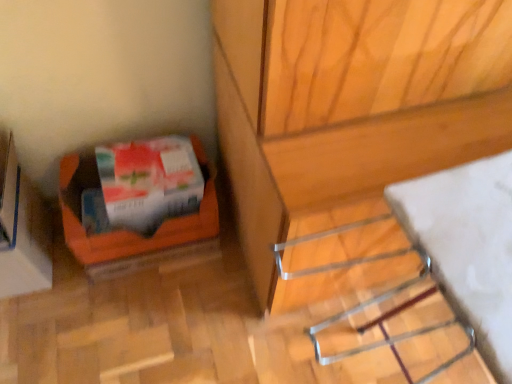
Describe the element at coordinates (129, 231) in the screenshot. I see `orange cardboard box at lower left` at that location.

Measure the distance between orange cardboard box at lower left and camera.

They are 3.63 feet apart.

What is the approximate width of metallic silver rack at lower right?

It is 30.26 centimeters.

The width and height of the screenshot is (512, 384). Find the location of `white glossy wrapping paper at lower left`. white glossy wrapping paper at lower left is located at coordinates (149, 182).

Based on their positions, is white glossy wrapping paper at lower left located to the left or right of metallic silver rack at lower right?

Based on their positions, white glossy wrapping paper at lower left is located to the left of metallic silver rack at lower right.

At what (x,y) coordinates should I click in order to perform the action: click on wrapping paper on the left of metallic silver rack at lower right. Please return your answer as a coordinate pair (x, y). The width and height of the screenshot is (512, 384). Looking at the image, I should click on (149, 182).

From the image's perspective, which is below, white glossy wrapping paper at lower left or metallic silver rack at lower right?

From the image's view, metallic silver rack at lower right is below.

From the image's perspective, which object appears higher, white glossy wrapping paper at lower left or orange cardboard box at lower left?

white glossy wrapping paper at lower left, from the image's perspective.

Is white glossy wrapping paper at lower left spatially inside orange cardboard box at lower left, or outside of it?

The correct answer is: outside.

From a real-world perspective, which object stands above the other?

white glossy wrapping paper at lower left.

Between white glossy wrapping paper at lower left and orange cardboard box at lower left, which one appears on the left side from the viewer's perspective?

orange cardboard box at lower left is more to the left.

Can you tell me how much orange cardboard box at lower left and metallic silver rack at lower right differ in facing direction?

5.37 degrees.

Consider the image. Does orange cardboard box at lower left come behind metallic silver rack at lower right?

Yes, orange cardboard box at lower left is further from the viewer.

Is orange cardboard box at lower left placed right next to metallic silver rack at lower right?

There is a gap between orange cardboard box at lower left and metallic silver rack at lower right.

Locate an element on the screen. furniture that appears above the orange cardboard box at lower left (from a real-world perspective) is located at coordinates (350, 123).

Can you tell me how much metallic silver rack at lower right and orange cardboard box at lower left differ in facing direction?

5.37 degrees separate the facing orientations of metallic silver rack at lower right and orange cardboard box at lower left.

Measure the distance between metallic silver rack at lower right and orange cardboard box at lower left.

metallic silver rack at lower right is 30.86 inches from orange cardboard box at lower left.

Considering the positions of objects metallic silver rack at lower right and orange cardboard box at lower left in the image provided, who is more to the left, metallic silver rack at lower right or orange cardboard box at lower left?

orange cardboard box at lower left.

From the image's perspective, relative to orange cardboard box at lower left, is metallic silver rack at lower right above or below?

Clearly, from the image's perspective, metallic silver rack at lower right is below orange cardboard box at lower left.

Is orange cardboard box at lower left spatially inside white glossy wrapping paper at lower left, or outside of it?

orange cardboard box at lower left is not inside white glossy wrapping paper at lower left, it's outside.

How many degrees apart are the facing directions of orange cardboard box at lower left and white glossy wrapping paper at lower left?

The angular difference between orange cardboard box at lower left and white glossy wrapping paper at lower left is 0.00155 degrees.

Considering their positions, is orange cardboard box at lower left located in front of or behind white glossy wrapping paper at lower left?

Clearly, orange cardboard box at lower left is behind white glossy wrapping paper at lower left.

Is orange cardboard box at lower left directly adjacent to white glossy wrapping paper at lower left?

Yes, orange cardboard box at lower left is next to white glossy wrapping paper at lower left.

How many degrees apart are the facing directions of orange cardboard box at lower left and orange cardboard box at lower left?

The facing directions of orange cardboard box at lower left and orange cardboard box at lower left are 0.0029 degrees apart.

You are a GUI agent. You are given a task and a screenshot of the screen. Output one action in this format:
    pyautogui.click(x=<x>, y=<y>)
    Task: Click on the box that appears on the right of orange cardboard box at lower left
    The height and width of the screenshot is (384, 512).
    Given the screenshot: What is the action you would take?
    pyautogui.click(x=129, y=231)

Looking at this image, can orange cardboard box at lower left be found inside orange cardboard box at lower left?

No, orange cardboard box at lower left is located outside of orange cardboard box at lower left.

Could you tell me if orange cardboard box at lower left is turned towards orange cardboard box at lower left?

No, orange cardboard box at lower left is not oriented towards orange cardboard box at lower left.

Does point (75, 163) come behind point (27, 267)?

Yes, point (75, 163) is behind point (27, 267).

Consider the image. From a real-world perspective, which object rests below the other?

Result: orange cardboard box at lower left is physically lower.

Between orange cardboard box at lower left and orange cardboard box at lower left, which one appears on the left side from the viewer's perspective?

orange cardboard box at lower left is more to the left.

How different are the orientations of orange cardboard box at lower left and orange cardboard box at lower left in degrees?

The angle between the facing direction of orange cardboard box at lower left and the facing direction of orange cardboard box at lower left is 0.0029 degrees.

Where is `furniture on the right of the white glossy wrapping paper at lower left`? This screenshot has height=384, width=512. furniture on the right of the white glossy wrapping paper at lower left is located at coordinates (350, 123).

Locate an element on the screen. The image size is (512, 384). wrapping paper behind the orange cardboard box at lower left is located at coordinates (149, 182).

Looking at the image, which one is located closer to white glossy wrapping paper at lower left, orange cardboard box at lower left or orange cardboard box at lower left?

Based on the image, orange cardboard box at lower left appears to be nearer to white glossy wrapping paper at lower left.

Looking at this image, looking at the image, which one is located closer to orange cardboard box at lower left, orange cardboard box at lower left or white glossy wrapping paper at lower left?

white glossy wrapping paper at lower left is closer to orange cardboard box at lower left.

From the image, which object appears to be nearer to orange cardboard box at lower left, orange cardboard box at lower left or metallic silver rack at lower right?

Based on the image, orange cardboard box at lower left appears to be nearer to orange cardboard box at lower left.

Looking at the image, which one is located further to white glossy wrapping paper at lower left, orange cardboard box at lower left or orange cardboard box at lower left?

orange cardboard box at lower left is positioned further to the anchor white glossy wrapping paper at lower left.

From the image, which object appears to be farther from orange cardboard box at lower left, white glossy wrapping paper at lower left or orange cardboard box at lower left?

orange cardboard box at lower left lies further to orange cardboard box at lower left than the other object.

Which object lies nearer to the anchor point white glossy wrapping paper at lower left, metallic silver rack at lower right or orange cardboard box at lower left?

orange cardboard box at lower left.

Considering their positions, is orange cardboard box at lower left positioned closer to white glossy wrapping paper at lower left than metallic silver rack at lower right?

orange cardboard box at lower left.

Looking at the image, which one is located further to orange cardboard box at lower left, white glossy wrapping paper at lower left or metallic silver rack at lower right?

metallic silver rack at lower right is positioned further to the anchor orange cardboard box at lower left.

This screenshot has height=384, width=512. Identify the location of box between orange cardboard box at lower left and metallic silver rack at lower right from left to right. (129, 231).

This screenshot has width=512, height=384. What are the coordinates of `wrapping paper between orange cardboard box at lower left and metallic silver rack at lower right in the horizontal direction` in the screenshot? It's located at (149, 182).

Identify the location of box between orange cardboard box at lower left and white glossy wrapping paper at lower left in the horizontal direction. (129, 231).

Identify the location of wrapping paper between orange cardboard box at lower left and metallic silver rack at lower right. The height and width of the screenshot is (384, 512). point(149,182).